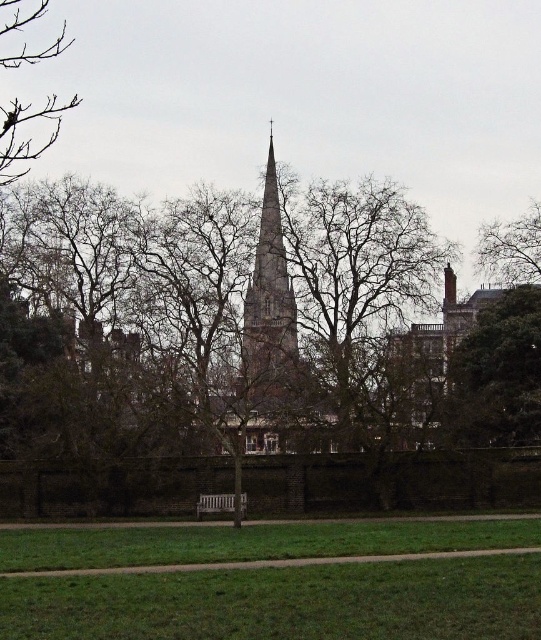
Question: Does brown brick steeple at center have a greater width compared to white wooden bench at center?

Choices:
 (A) yes
 (B) no

Answer: (A)

Question: Which object is farther from the camera taking this photo?

Choices:
 (A) brown brick steeple at center
 (B) brown leafless tree at upper left
 (C) white wooden bench at center

Answer: (C)

Question: Based on their relative distances, which object is nearer to the brown leafless tree at upper left?

Choices:
 (A) white wooden bench at center
 (B) green grass at lower center
 (C) brown leafless tree at upper right
 (D) green leafy tree at right

Answer: (B)

Question: Among these points, which one is farthest from the camera?

Choices:
 (A) (240, 502)
 (B) (45, 148)
 (C) (529, 218)

Answer: (B)

Question: Observing the image, what is the correct spatial positioning of green grass at lower center in reference to brown brick steeple at center?

Choices:
 (A) below
 (B) above

Answer: (A)

Question: Is green leafy tree at right above brown brick steeple at center?

Choices:
 (A) yes
 (B) no

Answer: (B)